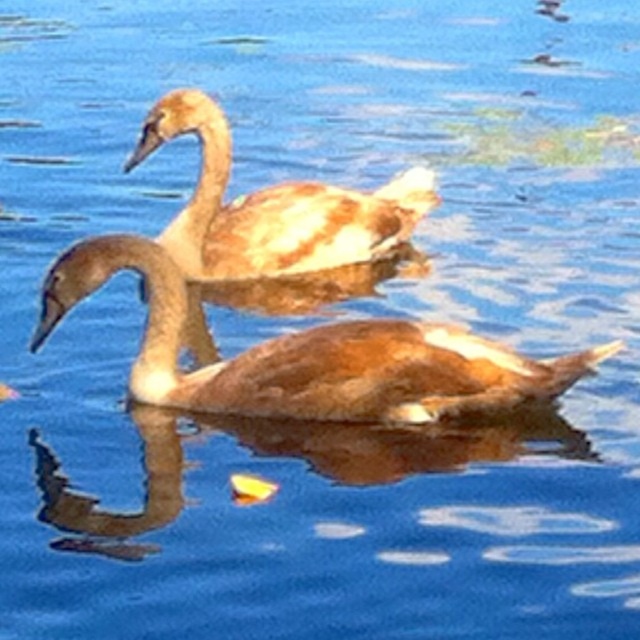
You are a photographer trying to capture the brown matte swan at center. Based on the coordinates provided, where should you aim your camera to get the best shot?

The brown matte swan at center is located at coordinates point (308,355), so you should aim your camera at that point to capture it.

You are a photographer trying to capture the brown matte swan at center. You have a camera with a zoom lens. The swan is located at point (x=308, y=355). Where should you aim your camera to ensure the swan is centered in your shot?

You should aim your camera directly at point (x=308, y=355) to ensure the brown matte swan at center is centered in your shot.